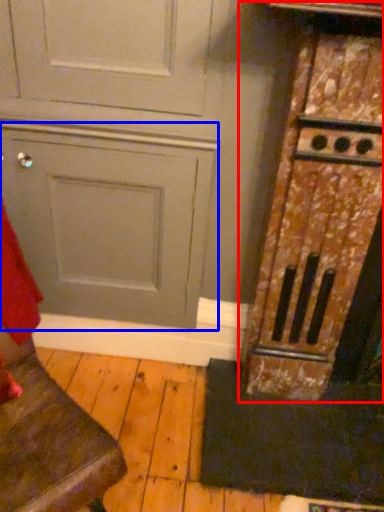
Question: Among these objects, which one is nearest to the camera, cabinetry (highlighted by a red box) or door (highlighted by a blue box)?

Choices:
 (A) cabinetry
 (B) door

Answer: (A)